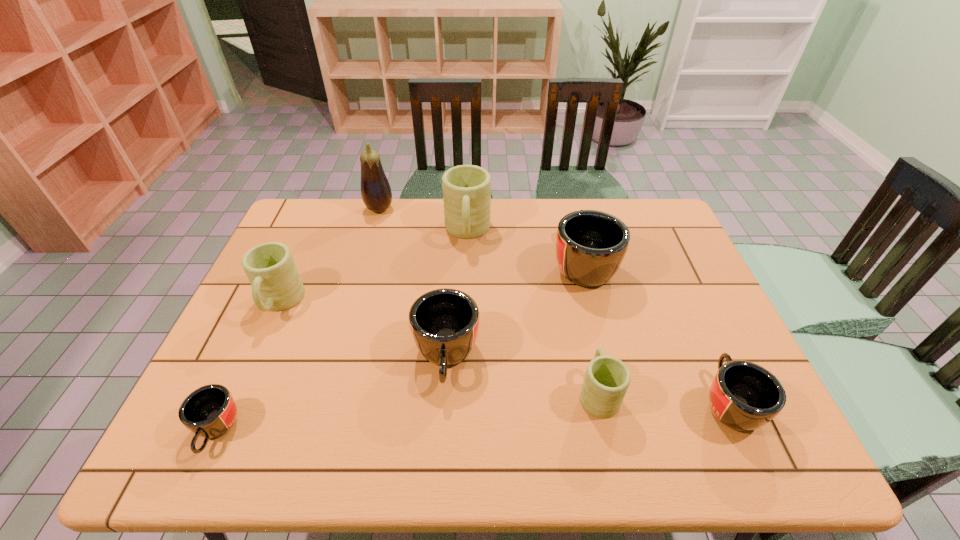
At what (x,y) coordinates should I click in order to perform the action: click on red mug that can be found as the closest to the sixth object from right to left. Please return your answer as a coordinate pair (x, y). The width and height of the screenshot is (960, 540). Looking at the image, I should click on (444, 323).

Identify the location of the closest red mug to the farthest red mug. The width and height of the screenshot is (960, 540). (444, 323).